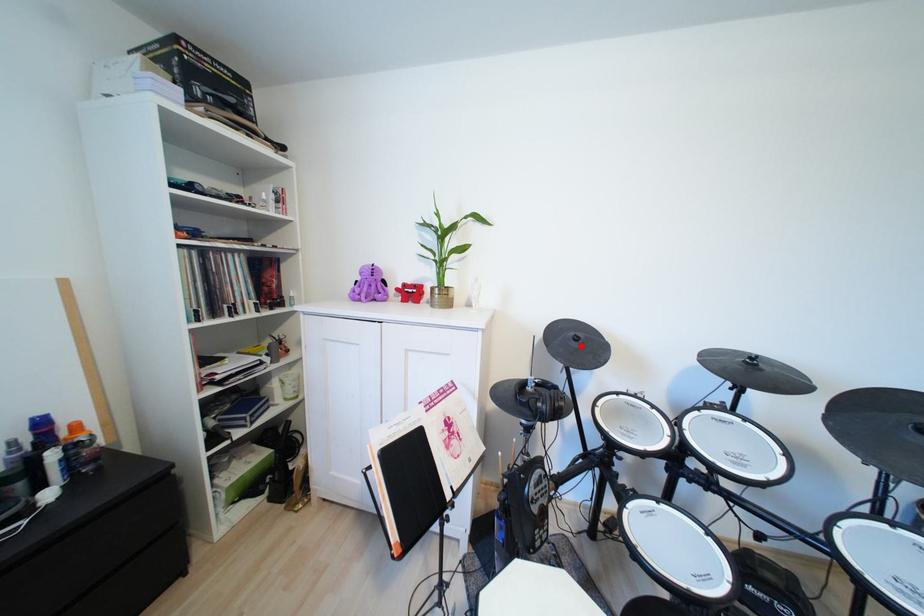
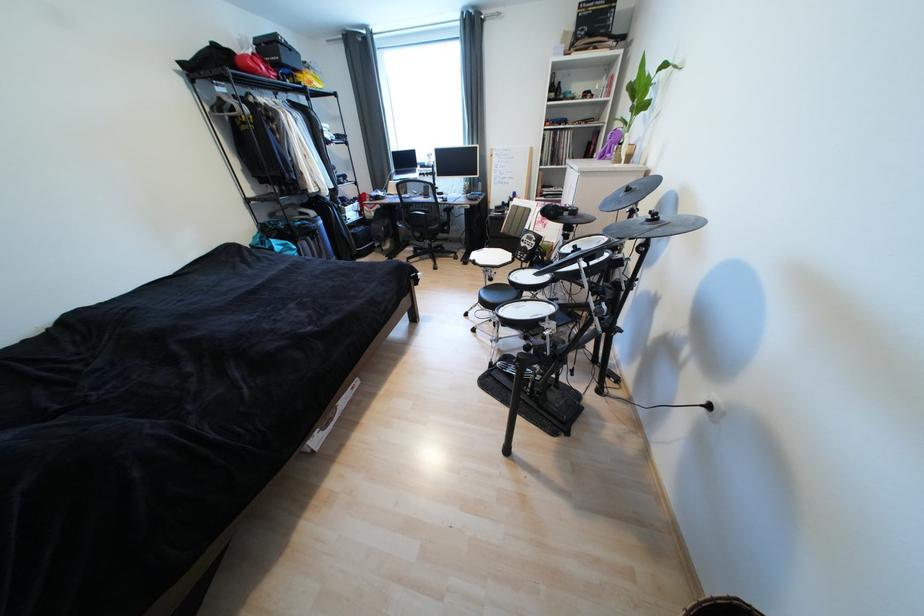
Question: I am providing you with two images of the same scene from different viewpoints. In image1, a red point is highlighted. Considering the same 3D point in image2, which of the following is correct?

Choices:
 (A) It is closer
 (B) It is farther

Answer: (A)